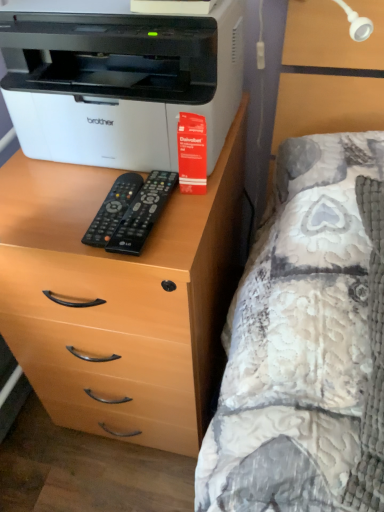
Question: Can you confirm if fluffy quilted bed at right is smaller than black plastic remote at center, the first remote when ordered from right to left?

Choices:
 (A) no
 (B) yes

Answer: (A)

Question: Does fluffy quilted bed at right have a lesser height compared to black plastic remote at center, the second remote viewed from the left?

Choices:
 (A) yes
 (B) no

Answer: (B)

Question: Does fluffy quilted bed at right have a greater height compared to black plastic remote at center, the first remote when ordered from right to left?

Choices:
 (A) yes
 (B) no

Answer: (A)

Question: Is fluffy quilted bed at right far away from black plastic remote at center, the first remote when ordered from right to left?

Choices:
 (A) no
 (B) yes

Answer: (A)

Question: Does fluffy quilted bed at right appear on the right side of black plastic remote at center, the first remote when ordered from right to left?

Choices:
 (A) yes
 (B) no

Answer: (A)

Question: From a real-world perspective, is fluffy quilted bed at right above or below black plastic remote at center, the first remote when ordered from right to left?

Choices:
 (A) above
 (B) below

Answer: (B)

Question: Relative to black plastic remote at center, the first remote when ordered from right to left, is fluffy quilted bed at right in front or behind?

Choices:
 (A) front
 (B) behind

Answer: (A)

Question: From the image's perspective, is fluffy quilted bed at right above or below black plastic remote at center, the second remote viewed from the left?

Choices:
 (A) below
 (B) above

Answer: (A)

Question: Is fluffy quilted bed at right taller or shorter than black plastic remote at center, the first remote when ordered from right to left?

Choices:
 (A) tall
 (B) short

Answer: (A)

Question: Is light brown wood chest of drawers at left taller or shorter than white plastic printer at upper left?

Choices:
 (A) tall
 (B) short

Answer: (A)

Question: Looking at the image, does light brown wood chest of drawers at left seem bigger or smaller compared to white plastic printer at upper left?

Choices:
 (A) small
 (B) big

Answer: (B)

Question: Is light brown wood chest of drawers at left in front of or behind white plastic printer at upper left in the image?

Choices:
 (A) front
 (B) behind

Answer: (B)

Question: Is light brown wood chest of drawers at left wider or thinner than white plastic printer at upper left?

Choices:
 (A) wide
 (B) thin

Answer: (A)

Question: In terms of width, does black plastic remote at center, arranged as the second remote when viewed from the right, look wider or thinner when compared to light brown wood chest of drawers at left?

Choices:
 (A) wide
 (B) thin

Answer: (B)

Question: Choose the correct answer: Is black plastic remote at center, arranged as the second remote when viewed from the right, inside light brown wood chest of drawers at left or outside it?

Choices:
 (A) outside
 (B) inside

Answer: (A)